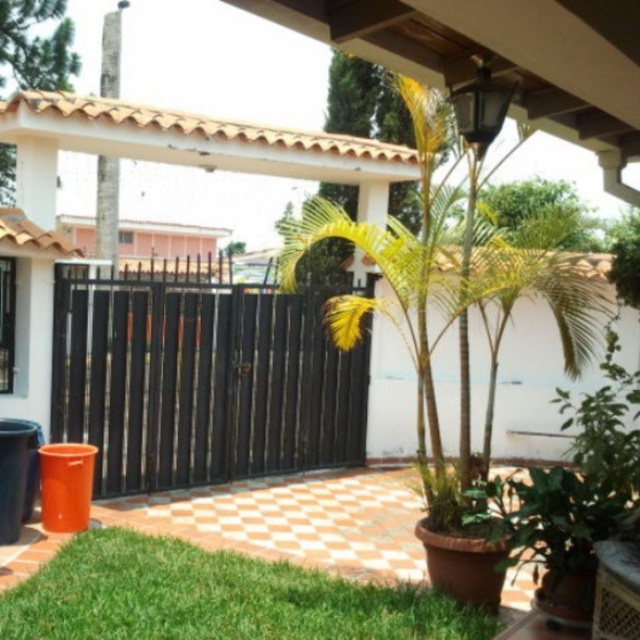
You are a delivery person with a cart that is 5 feet wide. You need to pass through the area between the black metal gate at center and the green leafy plant at lower left. Can your cart fit through the space between them?

The distance between the black metal gate at center and the green leafy plant at lower left is 7.86 feet, which is wider than your cart that is 5 feet wide. Therefore, your cart can fit through the space between them.

In the scene shown: You are standing in the courtyard and want to open the black metal gate at center. If your reach extends 6 feet in front of you, can you reach the gate without moving closer?

The black metal gate at center is 20.89 feet away from you, which is farther than your 6 feet reach. You need to move closer to reach it.

You are a delivery person trying to see if you can fit a 1.8 meters wide package through the gap between the black metal gate at center and the green leafy plant at lower left. Can you fit it through?

The black metal gate at center is taller than green leafy plant at lower left, but the question is about width. Since the objects description only mentions height, we cannot determine the width of the gap. Please check the actual space.